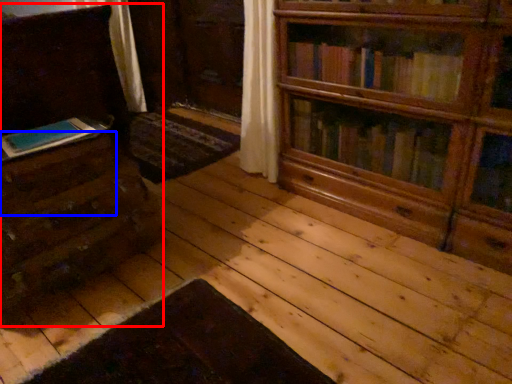
Question: Among these objects, which one is farthest to the camera, chest of drawers (highlighted by a red box) or drawer (highlighted by a blue box)?

Choices:
 (A) chest of drawers
 (B) drawer

Answer: (A)